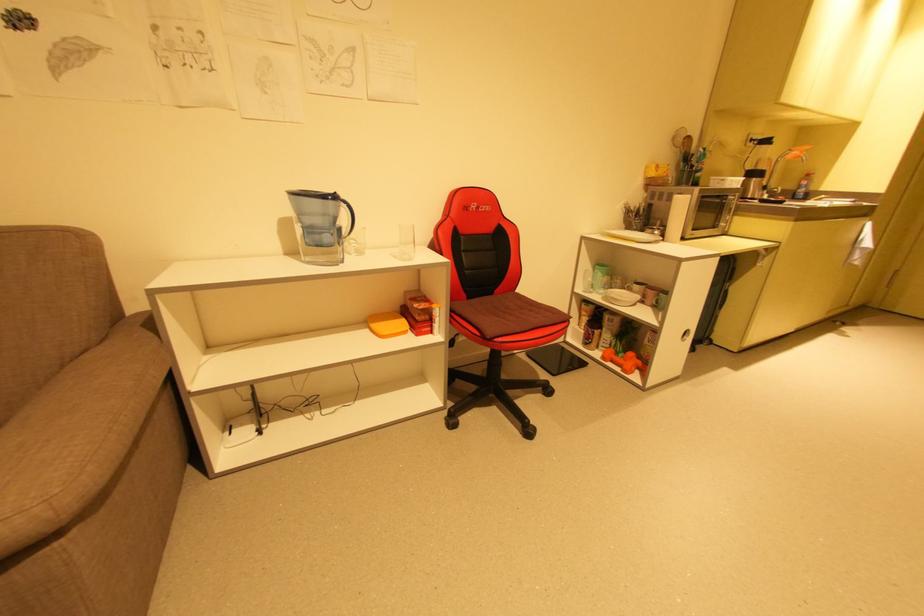
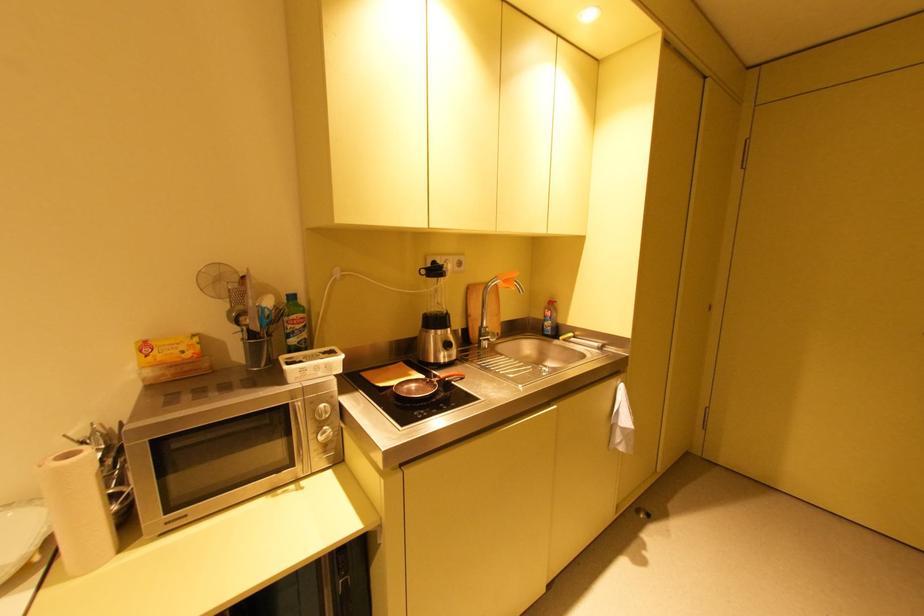
Based on the photo, in a continuous first-person perspective shot, in which direction is the camera moving?

The cameraman walked toward right, forward.